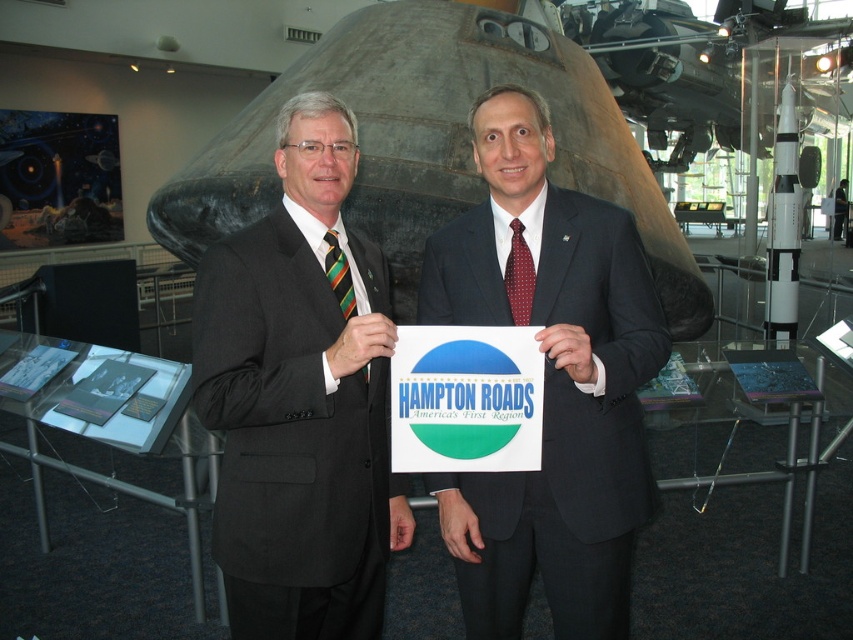
Question: Is white glossy rocket at right to the left of green striped tie at left from the viewer's perspective?

Choices:
 (A) no
 (B) yes

Answer: (A)

Question: Which point is farther to the camera?

Choices:
 (A) (527, 314)
 (B) (648, 353)
 (C) (352, 29)

Answer: (C)

Question: Among these points, which one is nearest to the camera?

Choices:
 (A) (576, 376)
 (B) (344, 266)

Answer: (A)

Question: Is black suit at center wider than shiny metallic rocket at center?

Choices:
 (A) yes
 (B) no

Answer: (B)

Question: Can you confirm if black suit at center is wider than white glossy rocket at right?

Choices:
 (A) yes
 (B) no

Answer: (B)

Question: Which object is closer to the camera taking this photo?

Choices:
 (A) green striped tie at left
 (B) black suit at center
 (C) red dotted silk tie at center
 (D) white glossy rocket at right

Answer: (B)